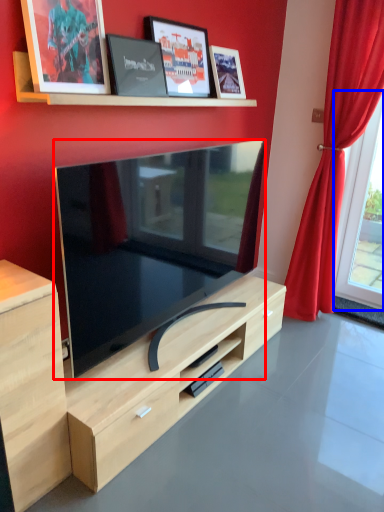
Question: Which point is further to the camera, television (highlighted by a red box) or window (highlighted by a blue box)?

Choices:
 (A) television
 (B) window

Answer: (B)